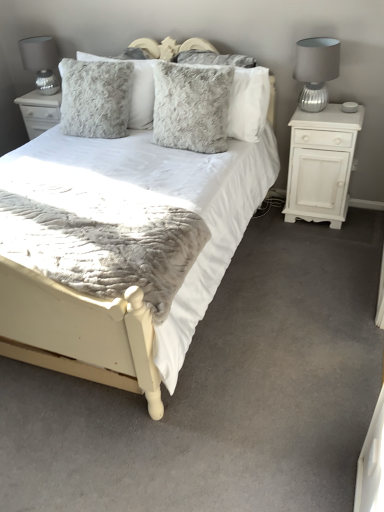
You are a GUI agent. You are given a task and a screenshot of the screen. Output one action in this format:
    pyautogui.click(x=<x>, y=<y>)
    Task: Click on the free region on the left part of white matte cabinet at right
    The height and width of the screenshot is (512, 384).
    Given the screenshot: What is the action you would take?
    pyautogui.click(x=267, y=228)